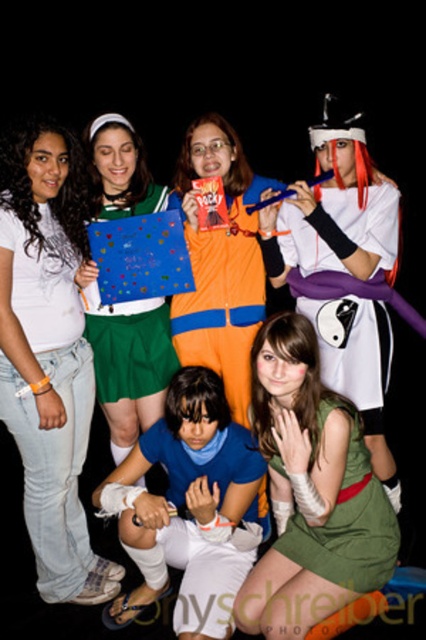
You are a photographer trying to focus on two points in the image. One is at point (x=89, y=563) and the other is at point (x=149, y=356). Which point should you focus on first if you want to start with the one closer to the camera?

You should focus on point (x=89, y=563) first because it is closer to the camera than point (x=149, y=356) according to the description.